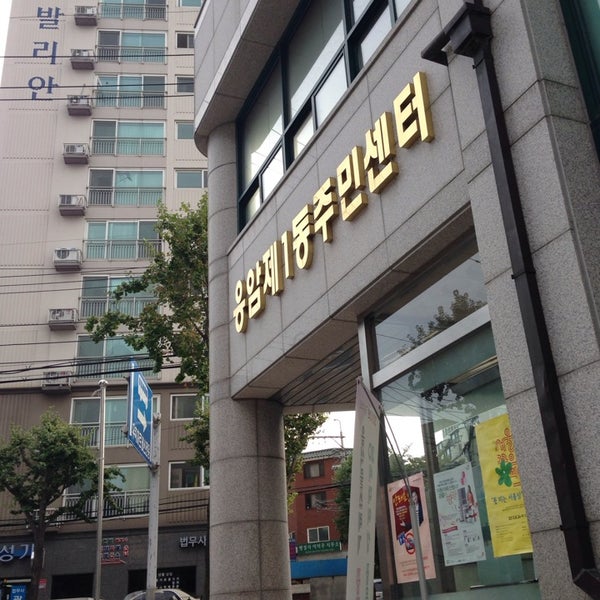
You are a GUI agent. You are given a task and a screenshot of the screen. Output one action in this format:
    pyautogui.click(x=<x>, y=<y>)
    Task: Click on the air conditioners
    This screenshot has height=600, width=600.
    Given the screenshot: What is the action you would take?
    pyautogui.click(x=53, y=379), pyautogui.click(x=62, y=312), pyautogui.click(x=64, y=257), pyautogui.click(x=69, y=199), pyautogui.click(x=76, y=147), pyautogui.click(x=73, y=103), pyautogui.click(x=82, y=52), pyautogui.click(x=83, y=12)